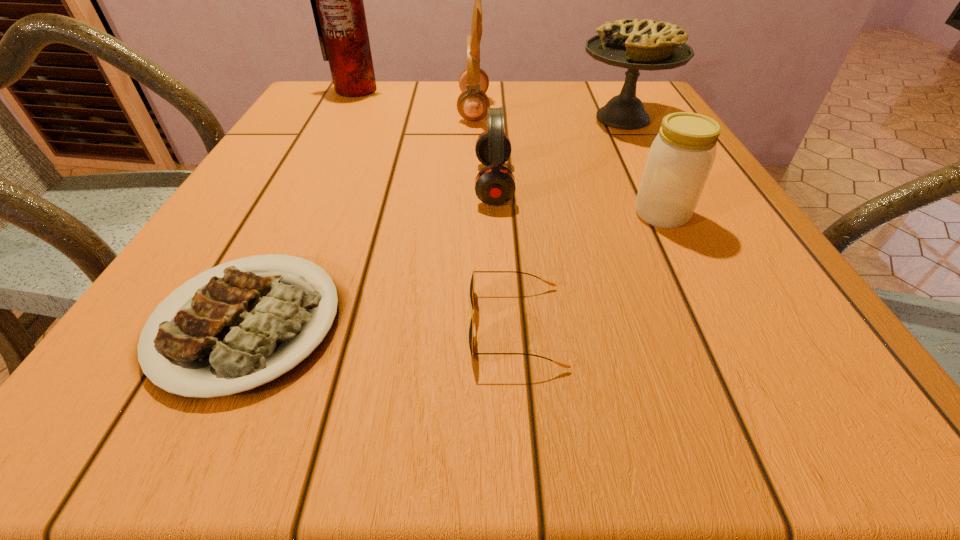
Locate an element on the screen. The height and width of the screenshot is (540, 960). vacant space located on the front-facing side of the farther earphone is located at coordinates (559, 109).

In order to click on vacant space situated on the cut side of the fifth shortest object in this screenshot , I will do `click(524, 118)`.

The height and width of the screenshot is (540, 960). I want to click on vacant space located on the cut side of the fifth shortest object, so click(x=528, y=118).

Locate an element on the screen. The width and height of the screenshot is (960, 540). free space located 0.110m on the cut side of the fifth shortest object is located at coordinates (528, 118).

The image size is (960, 540). I want to click on vacant space situated on the back of the jar, so click(613, 117).

Where is `vacant area situated on the ear cups of the third shortest object`? The image size is (960, 540). vacant area situated on the ear cups of the third shortest object is located at coordinates (317, 184).

Where is `vacant area located on the ear cups of the third shortest object`? vacant area located on the ear cups of the third shortest object is located at coordinates (265, 184).

Identify the location of vacant space located 0.060m on the ear cups of the third shortest object. (444, 184).

Identify the location of free space located 0.110m on the front-facing side of the sixth tallest object. (387, 326).

In order to click on free space located on the front-facing side of the sixth tallest object in this screenshot , I will do `click(297, 326)`.